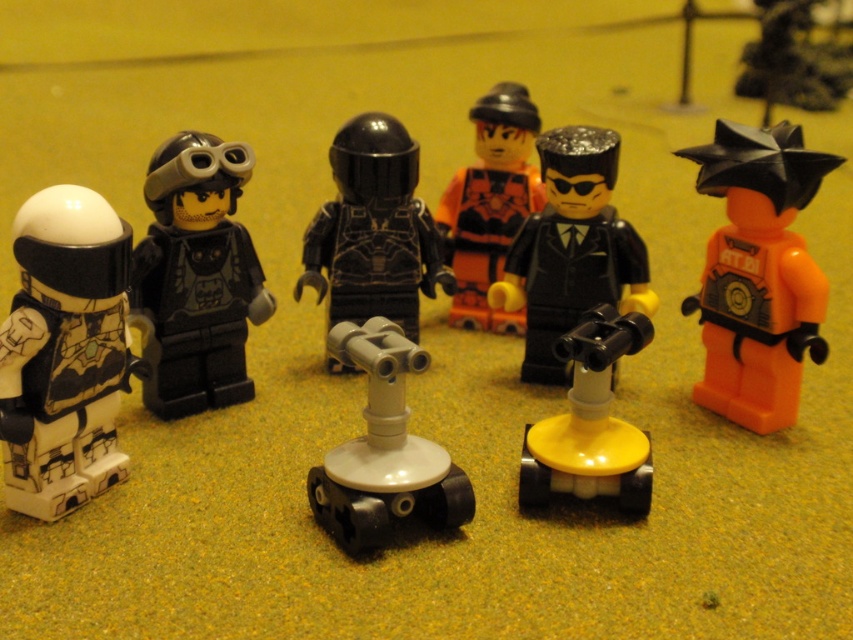
Question: Which of the following is the closest to the observer?

Choices:
 (A) (165, 387)
 (B) (439, 460)
 (C) (494, 204)
 (D) (755, 381)

Answer: (B)

Question: Which of the following is the closest to the observer?

Choices:
 (A) white plastic tripod at center
 (B) black matte helmet at center

Answer: (A)

Question: Can you confirm if white plastic tripod at center is smaller than yellow matte joystick at center?

Choices:
 (A) no
 (B) yes

Answer: (A)

Question: Where is white matte helmet at left located in relation to white plastic tripod at center in the image?

Choices:
 (A) right
 (B) left

Answer: (B)

Question: Among these points, which one is farthest from the camera?

Choices:
 (A) (432, 518)
 (B) (173, 332)
 (C) (538, 209)
 (D) (323, 284)

Answer: (C)

Question: Can you confirm if matte black helmet at left is thinner than shiny black suit at center?

Choices:
 (A) yes
 (B) no

Answer: (A)